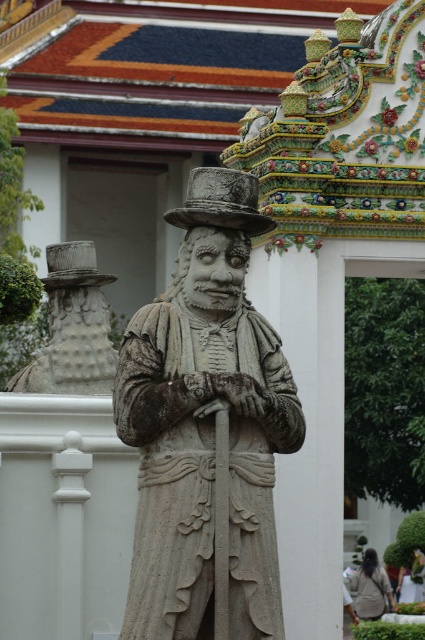
Who is higher up, stone statue at center or gray stone statue at left?

Positioned higher is gray stone statue at left.

Does point (172, 344) lie in front of point (112, 376)?

Yes, it is in front of point (112, 376).

This screenshot has width=425, height=640. In order to click on stone statue at center in this screenshot , I will do `click(206, 429)`.

Is gray stone statue at left above light brown fabric jacket at lower right?

Indeed, gray stone statue at left is positioned over light brown fabric jacket at lower right.

Is gray stone statue at left in front of light brown fabric jacket at lower right?

Yes, it is.

At what (x,y) coordinates should I click in order to perform the action: click on gray stone statue at left. Please return your answer as a coordinate pair (x, y). This screenshot has width=425, height=640. Looking at the image, I should click on (73, 326).

Identify the location of gray stone statue at left. This screenshot has width=425, height=640. coord(73,326).

Looking at this image, who is positioned more to the left, stone statue at center or light brown fabric jacket at lower right?

stone statue at center is more to the left.

Is point (272, 582) positioned after point (357, 598)?

No, it is in front of (357, 598).

Is point (235, 632) farther from camera compared to point (357, 612)?

No.

Find the location of a particular element. The width and height of the screenshot is (425, 640). stone statue at center is located at coordinates [206, 429].